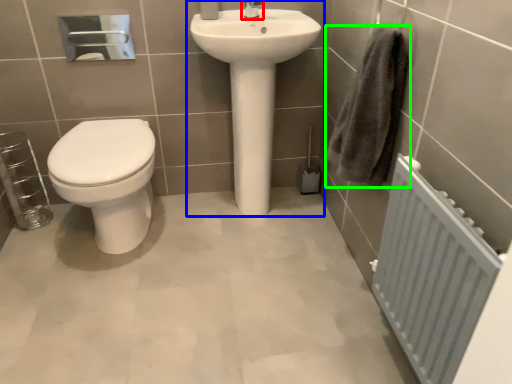
Question: Estimate the real-world distances between objects in this image. Which object is farther from tap (highlighted by a red box), sink (highlighted by a blue box) or bath towel (highlighted by a green box)?

Choices:
 (A) sink
 (B) bath towel

Answer: (B)